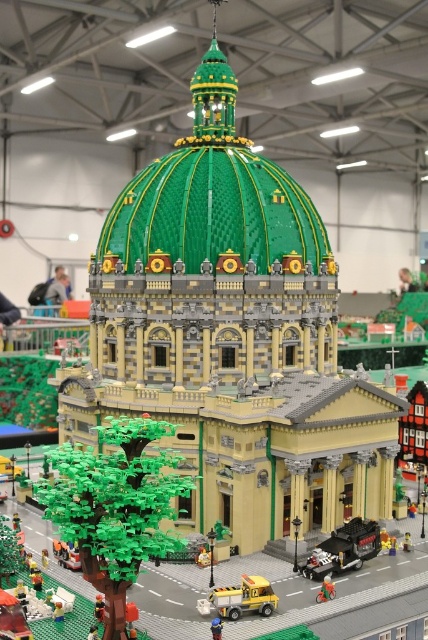
Can you confirm if yellow plastic truck at lower center is smaller than blue plastic toy at lower center?

Incorrect, yellow plastic truck at lower center is not smaller in size than blue plastic toy at lower center.

Is yellow plastic truck at lower center below blue plastic toy at lower center?

Actually, yellow plastic truck at lower center is above blue plastic toy at lower center.

Is point (253, 605) less distant than point (216, 621)?

No, it is behind (216, 621).

Image resolution: width=428 pixels, height=640 pixels. I want to click on yellow plastic truck at lower center, so click(243, 596).

Can you confirm if dark gray plastic truck at center is smaller than brick-like car at center?

No.

Does point (344, 525) come farther from viewer compared to point (404, 548)?

No.

Between point (341, 524) and point (403, 547), which one is positioned in front?

Point (403, 547)

This screenshot has height=640, width=428. In order to click on dark gray plastic truck at center in this screenshot , I will do `click(344, 548)`.

Does green plastic tree at lower left appear over blue plastic toy at lower center?

Correct, green plastic tree at lower left is located above blue plastic toy at lower center.

Which is in front, point (112, 529) or point (213, 628)?

Point (112, 529)

The height and width of the screenshot is (640, 428). What are the coordinates of `green plastic tree at lower left` in the screenshot? It's located at (115, 506).